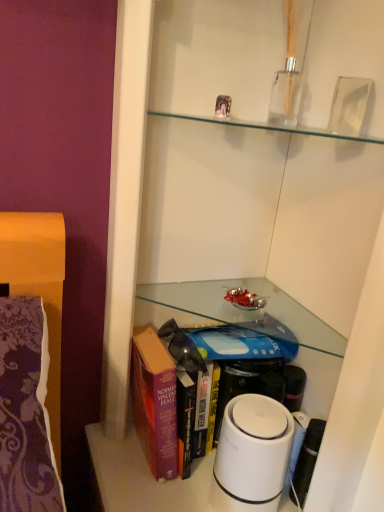
This screenshot has width=384, height=512. What are the coordinates of `white plastic humidifier at lower center` in the screenshot? It's located at (252, 454).

Describe the element at coordinates (252, 454) in the screenshot. I see `white plastic humidifier at lower center` at that location.

What is the approximate height of purple hardcover book at lower center?

It is 10.49 inches.

The image size is (384, 512). What do you see at coordinates (176, 369) in the screenshot?
I see `purple hardcover book at lower center` at bounding box center [176, 369].

Locate an element on the screen. Image resolution: width=384 pixels, height=512 pixels. purple hardcover book at lower center is located at coordinates (176, 369).

Find the location of a particular element. Image resolution: width=384 pixels, height=512 pixels. white plastic humidifier at lower center is located at coordinates (252, 454).

From the picture: Is purple hardcover book at lower center to the left or to the right of white plastic humidifier at lower center in the image?

In the image, purple hardcover book at lower center appears on the left side of white plastic humidifier at lower center.

Which object is further away from the camera taking this photo, purple hardcover book at lower center or white plastic humidifier at lower center?

purple hardcover book at lower center is behind.

Which is nearer, [280,344] or [239,423]?

Point [239,423]

From the image's perspective, which object appears higher, purple hardcover book at lower center or white plastic humidifier at lower center?

From the image's view, purple hardcover book at lower center is above.

From a real-world perspective, which object rests below the other?

white plastic humidifier at lower center is physically lower.

Which of these two, purple hardcover book at lower center or white plastic humidifier at lower center, is thinner?

Thinner between the two is white plastic humidifier at lower center.

Considering the sizes of objects purple hardcover book at lower center and white plastic humidifier at lower center in the image provided, who is shorter, purple hardcover book at lower center or white plastic humidifier at lower center?

Standing shorter between the two is white plastic humidifier at lower center.

Considering the sizes of purple hardcover book at lower center and white plastic humidifier at lower center in the image, is purple hardcover book at lower center bigger or smaller than white plastic humidifier at lower center?

Clearly, purple hardcover book at lower center is larger in size than white plastic humidifier at lower center.

Does purple hardcover book at lower center contain white plastic humidifier at lower center?

That's correct, white plastic humidifier at lower center is inside purple hardcover book at lower center.

Is purple hardcover book at lower center next to white plastic humidifier at lower center and touching it?

No, purple hardcover book at lower center is not touching white plastic humidifier at lower center.

Is purple hardcover book at lower center aimed at white plastic humidifier at lower center?

Yes, purple hardcover book at lower center is aimed at white plastic humidifier at lower center.

Locate an element on the screen. Image resolution: width=384 pixels, height=512 pixels. home appliance in front of the purple hardcover book at lower center is located at coordinates (252, 454).

Based on the photo, is white plastic humidifier at lower center at the right side of purple hardcover book at lower center?

Yes.

From the picture: Considering the positions of objects white plastic humidifier at lower center and purple hardcover book at lower center in the image provided, who is in front, white plastic humidifier at lower center or purple hardcover book at lower center?

white plastic humidifier at lower center.

Is point (237, 505) less distant than point (187, 435)?

Yes, point (237, 505) is in front of point (187, 435).

From the image's perspective, is white plastic humidifier at lower center located above or below purple hardcover book at lower center?

white plastic humidifier at lower center is below purple hardcover book at lower center.

From a real-world perspective, who is located higher, white plastic humidifier at lower center or purple hardcover book at lower center?

purple hardcover book at lower center is physically above.

Considering the relative sizes of white plastic humidifier at lower center and purple hardcover book at lower center in the image provided, is white plastic humidifier at lower center wider than purple hardcover book at lower center?

No, white plastic humidifier at lower center is not wider than purple hardcover book at lower center.

Which of these two, white plastic humidifier at lower center or purple hardcover book at lower center, stands taller?

Standing taller between the two is purple hardcover book at lower center.

Does white plastic humidifier at lower center have a smaller size compared to purple hardcover book at lower center?

Yes, white plastic humidifier at lower center is smaller than purple hardcover book at lower center.

Is white plastic humidifier at lower center surrounding purple hardcover book at lower center?

No, purple hardcover book at lower center is located outside of white plastic humidifier at lower center.

Does white plastic humidifier at lower center touch purple hardcover book at lower center?

white plastic humidifier at lower center and purple hardcover book at lower center are clearly separated.

Could you tell me if white plastic humidifier at lower center is facing purple hardcover book at lower center?

No, white plastic humidifier at lower center is not oriented towards purple hardcover book at lower center.

How different are the orientations of white plastic humidifier at lower center and purple hardcover book at lower center in degrees?

white plastic humidifier at lower center and purple hardcover book at lower center are facing 1.46 degrees away from each other.

This screenshot has height=512, width=384. Find the location of `book above the white plastic humidifier at lower center (from a real-world perspective)`. book above the white plastic humidifier at lower center (from a real-world perspective) is located at coordinates (176, 369).

Image resolution: width=384 pixels, height=512 pixels. What are the coordinates of `book that is behind the white plastic humidifier at lower center` in the screenshot? It's located at [x=176, y=369].

You are a GUI agent. You are given a task and a screenshot of the screen. Output one action in this format:
    pyautogui.click(x=<x>, y=<y>)
    Task: Click on the home appliance that is under the purple hardcover book at lower center (from a real-world perspective)
    The image size is (384, 512).
    Given the screenshot: What is the action you would take?
    pyautogui.click(x=252, y=454)